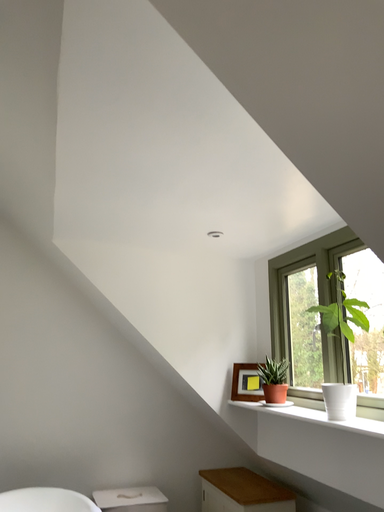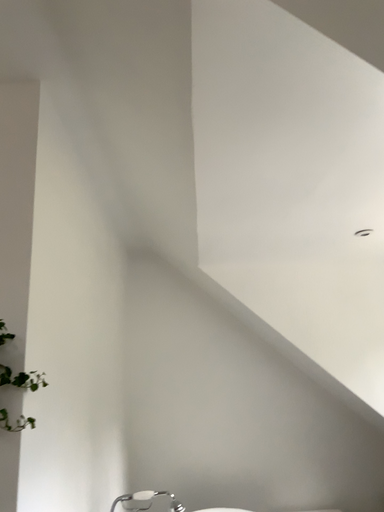
Question: Which way did the camera rotate in the video?

Choices:
 (A) rotated right
 (B) rotated left

Answer: (B)